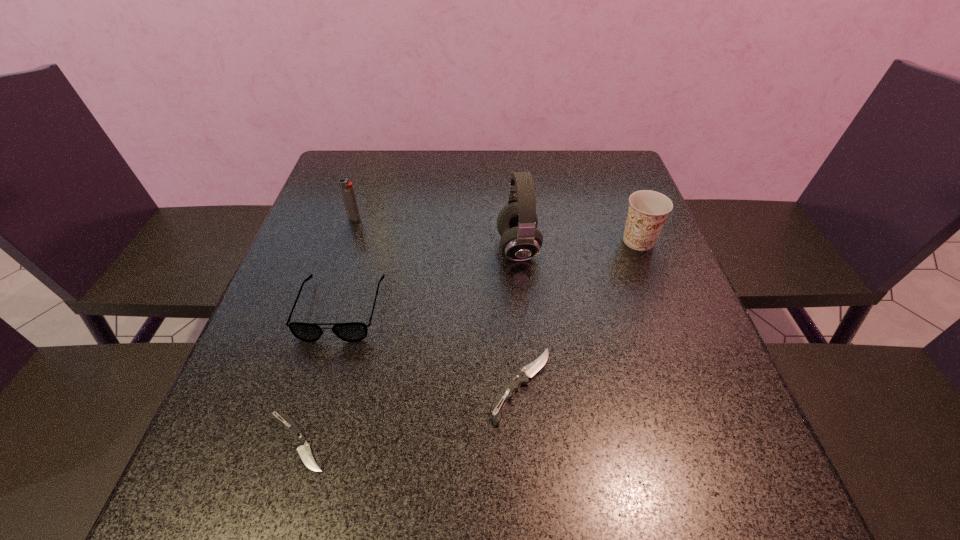
This screenshot has width=960, height=540. Find the location of `vacant space that is in between the shortest object and the tallest object`. vacant space that is in between the shortest object and the tallest object is located at coordinates (407, 346).

The image size is (960, 540). I want to click on unoccupied area between the Dixie cup and the headset, so click(578, 245).

Identify the location of vacant point located between the rightmost object and the fourth tallest object. (490, 275).

This screenshot has height=540, width=960. In order to click on free space between the spectacles and the left pocketknife in this screenshot , I will do `click(318, 376)`.

Locate an element on the screen. Image resolution: width=960 pixels, height=540 pixels. vacant region between the shorter pocketknife and the igniter is located at coordinates (324, 330).

Where is `free space between the headset and the taller pocketknife`? free space between the headset and the taller pocketknife is located at coordinates (519, 317).

The height and width of the screenshot is (540, 960). What are the coordinates of `empty space between the left pocketknife and the third shortest object` in the screenshot? It's located at (318, 376).

Image resolution: width=960 pixels, height=540 pixels. Identify the location of vacant point located between the Dixie cup and the headset. click(x=578, y=245).

You are a GUI agent. You are given a task and a screenshot of the screen. Output one action in this format:
    pyautogui.click(x=<x>, y=<y>)
    Task: Click on the free space between the farthest object and the tallest object
    The height and width of the screenshot is (540, 960).
    Given the screenshot: What is the action you would take?
    pyautogui.click(x=436, y=234)

The width and height of the screenshot is (960, 540). I want to click on object that is the second closest to the farthest object, so click(517, 222).